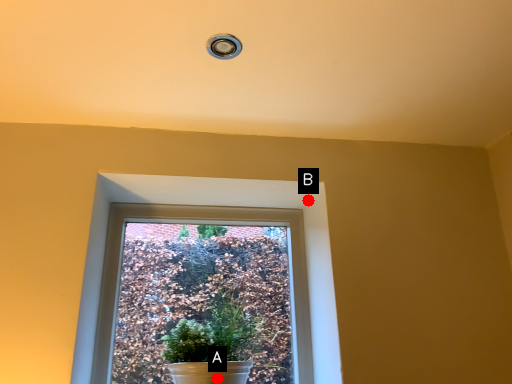
Question: Two points are circled on the image, labeled by A and B beside each circle. Which of the following is the farthest from the observer?

Choices:
 (A) A is further
 (B) B is further

Answer: (B)